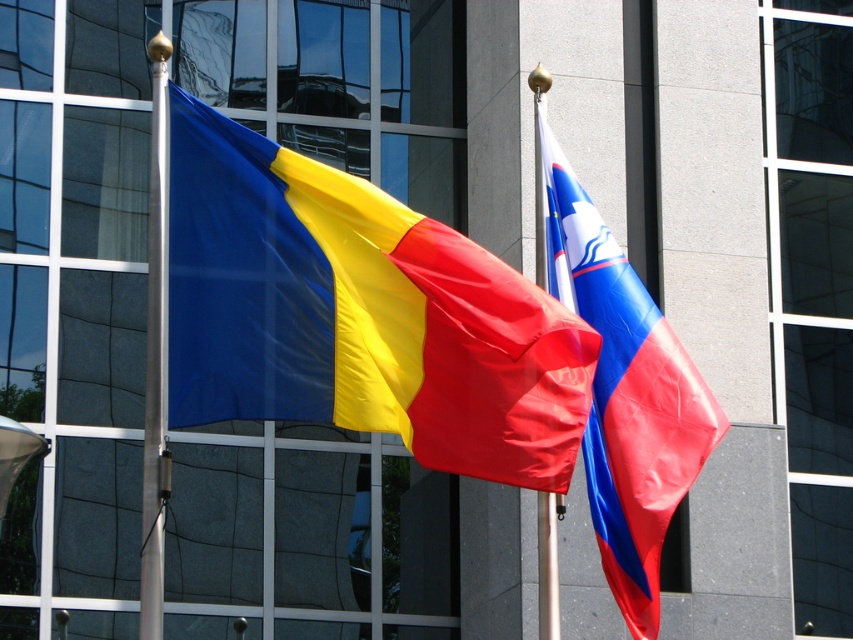
You are a photographer trying to capture both flags in a single shot. Given that the silky fabric flag at left is larger than the blue and white fabric flag at center, which flag should you position closer to the camera to ensure both appear equally sized in the photo?

To make both flags appear equally sized in the photo, you should position the smaller blue and white fabric flag at center closer to the camera since the silky fabric flag at left is larger in size.

You are an architect designing a new plaza and want to place both the blue and white fabric flag at center and the metallic silver flag pole at center in a way that maintains visual balance. Considering their sizes, which object should be placed farther back to achieve this balance?

The metallic silver flag pole at center should be placed farther back because the blue and white fabric flag at center is wider, so positioning the narrower flag pole further away will help balance their visual weight.

You are standing in front of a modern building with two flags. You see the silky fabric flag at left and the blue and white fabric flag at center. Which flag is closer to you?

The silky fabric flag at left is closer to you because it is in front of the blue and white fabric flag at center.